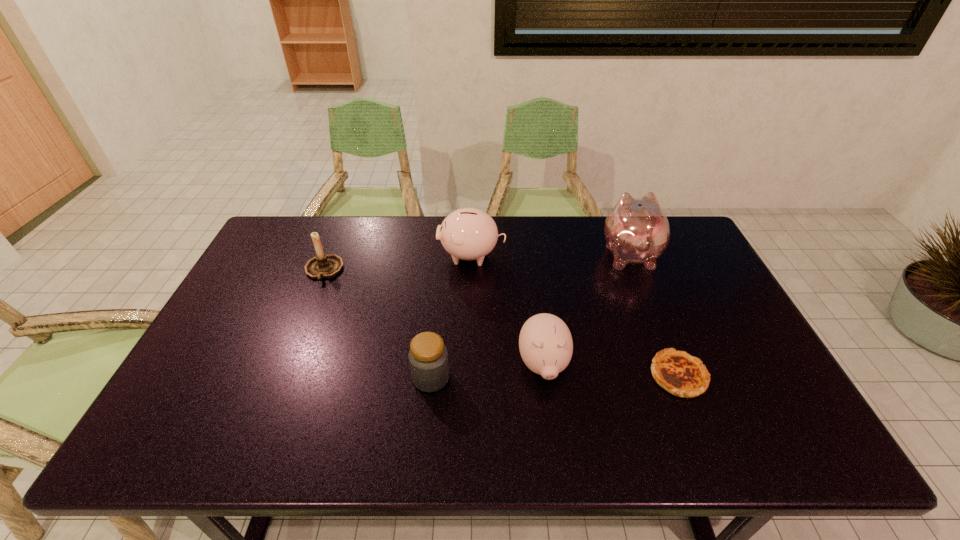
Locate an element on the screen. The width and height of the screenshot is (960, 540). vacant region that satisfies the following two spatial constraints: 1. at the snout of the second piggy bank from left to right; 2. on the surface of the jar near the warning symbol is located at coordinates (545, 377).